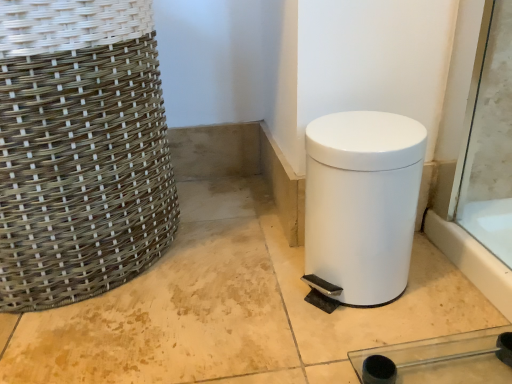
Question: Are woven natural fiber basket at left and white matte waste container at lower right located far from each other?

Choices:
 (A) yes
 (B) no

Answer: (B)

Question: Are woven natural fiber basket at left and white matte waste container at lower right making contact?

Choices:
 (A) no
 (B) yes

Answer: (A)

Question: Is woven natural fiber basket at left smaller than white matte waste container at lower right?

Choices:
 (A) no
 (B) yes

Answer: (A)

Question: From a real-world perspective, is woven natural fiber basket at left positioned under white matte waste container at lower right based on gravity?

Choices:
 (A) yes
 (B) no

Answer: (B)

Question: Does woven natural fiber basket at left turn towards white matte waste container at lower right?

Choices:
 (A) yes
 (B) no

Answer: (B)

Question: Can you confirm if woven natural fiber basket at left is taller than white matte waste container at lower right?

Choices:
 (A) yes
 (B) no

Answer: (A)

Question: Is the surface of white matte waste container at lower right in direct contact with woven natural fiber basket at left?

Choices:
 (A) no
 (B) yes

Answer: (A)

Question: Could you tell me if white matte waste container at lower right is turned towards woven natural fiber basket at left?

Choices:
 (A) yes
 (B) no

Answer: (B)

Question: Can you confirm if white matte waste container at lower right is taller than woven natural fiber basket at left?

Choices:
 (A) no
 (B) yes

Answer: (A)

Question: Is white matte waste container at lower right outside woven natural fiber basket at left?

Choices:
 (A) no
 (B) yes

Answer: (B)

Question: From a real-world perspective, is white matte waste container at lower right physically above woven natural fiber basket at left?

Choices:
 (A) no
 (B) yes

Answer: (A)

Question: Does white matte waste container at lower right have a larger size compared to woven natural fiber basket at left?

Choices:
 (A) yes
 (B) no

Answer: (B)

Question: Considering the positions of white matte waste container at lower right and woven natural fiber basket at left in the image, is white matte waste container at lower right wider or thinner than woven natural fiber basket at left?

Choices:
 (A) wide
 (B) thin

Answer: (B)